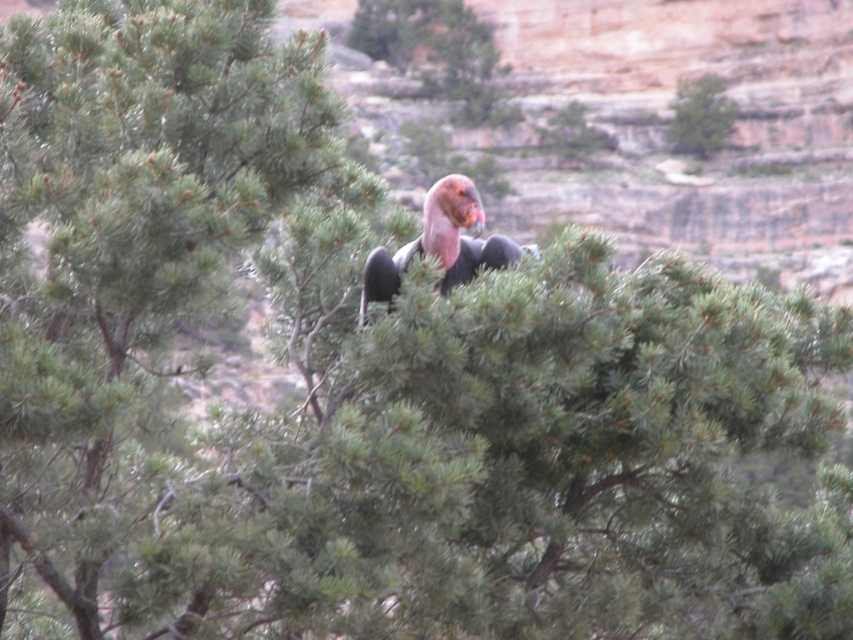
Question: Is pink feathered bird at center wider than green matte tree at upper center?

Choices:
 (A) yes
 (B) no

Answer: (A)

Question: Which object is closer to the camera taking this photo?

Choices:
 (A) pink feathered bird at center
 (B) green matte tree at upper center

Answer: (A)

Question: Is pink feathered bird at center bigger than green matte tree at upper center?

Choices:
 (A) yes
 (B) no

Answer: (A)

Question: Is pink feathered bird at center below green matte tree at upper center?

Choices:
 (A) yes
 (B) no

Answer: (A)

Question: Among these objects, which one is nearest to the camera?

Choices:
 (A) green matte tree at upper center
 (B) pink feathered bird at center

Answer: (B)